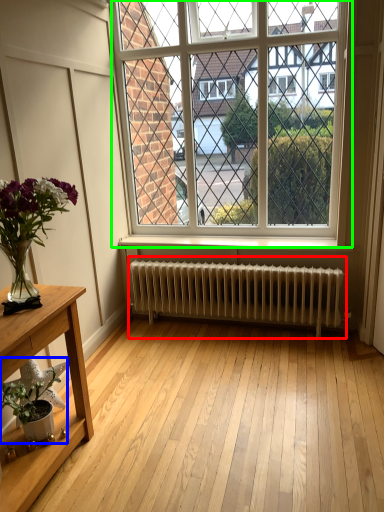
Question: Which object is the farthest from radiator (highlighted by a red box)? Choose among these: houseplant (highlighted by a blue box) or window (highlighted by a green box).

Choices:
 (A) houseplant
 (B) window

Answer: (A)